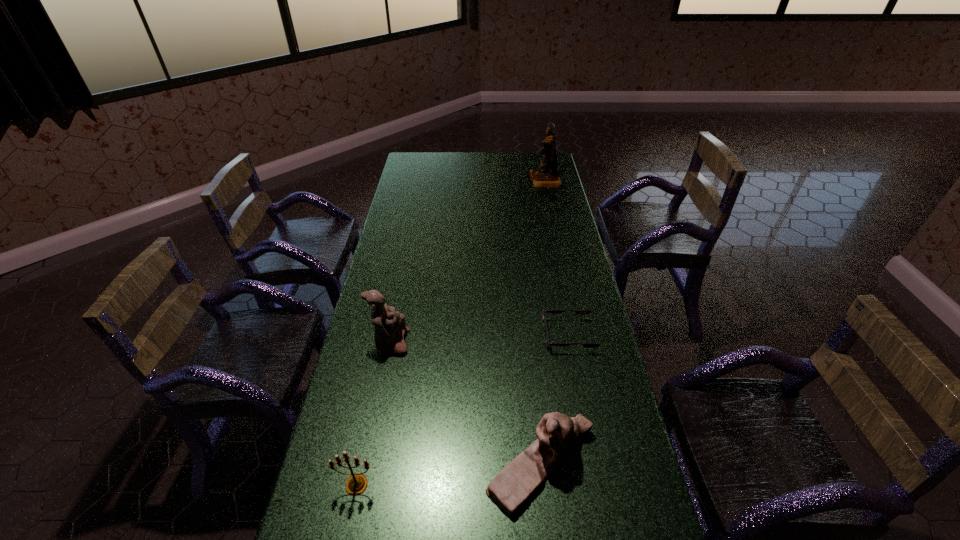
Where is `candelabrum at the left edge`? candelabrum at the left edge is located at coordinates (357, 483).

Locate an element on the screen. The height and width of the screenshot is (540, 960). sunglasses present at the right edge is located at coordinates (578, 311).

The height and width of the screenshot is (540, 960). Find the location of `object at the far right corner`. object at the far right corner is located at coordinates (546, 175).

Locate an element on the screen. vacant space at the far edge of the desktop is located at coordinates (502, 153).

Identify the location of blank space at the left edge of the desktop. The height and width of the screenshot is (540, 960). (423, 195).

Where is `free space at the right edge of the desktop`? The width and height of the screenshot is (960, 540). free space at the right edge of the desktop is located at coordinates (598, 489).

This screenshot has height=540, width=960. I want to click on vacant space at the far left corner of the desktop, so (x=406, y=158).

The height and width of the screenshot is (540, 960). Find the location of `empty space between the leftmost figurine and the candelabrum`. empty space between the leftmost figurine and the candelabrum is located at coordinates (373, 414).

Find the location of a particular element. The width and height of the screenshot is (960, 540). free space between the second shortest figurine and the sunglasses is located at coordinates (479, 339).

The width and height of the screenshot is (960, 540). In order to click on free spot between the tallest figurine and the shortest object in this screenshot , I will do `click(557, 258)`.